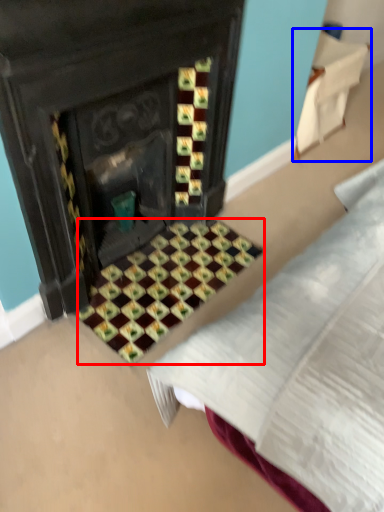
Question: Which object appears closest to the camera in this image, pattern (highlighted by a red box) or furniture (highlighted by a blue box)?

Choices:
 (A) pattern
 (B) furniture

Answer: (A)